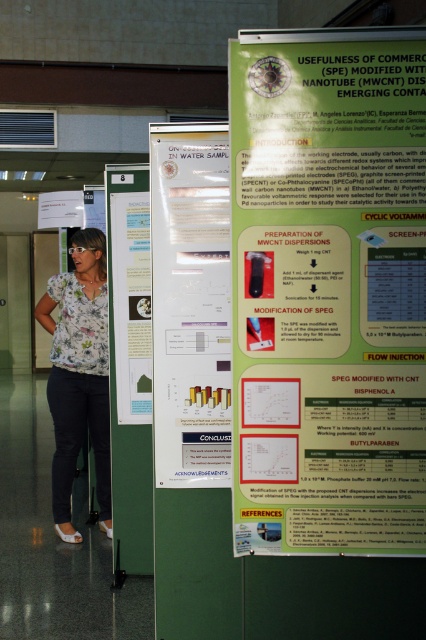
Does white paper at center have a lesser width compared to floral print blouse at center?

Yes, white paper at center is thinner than floral print blouse at center.

Can you confirm if white paper at center is positioned above floral print blouse at center?

Yes.

I want to click on white paper at center, so 190,304.

Who is more distant from viewer, [63,323] or [109,170]?

The point [63,323] is more distant.

The width and height of the screenshot is (426, 640). Describe the element at coordinates (78, 374) in the screenshot. I see `floral print blouse at center` at that location.

Which is in front, point (66, 442) or point (123, 410)?

Point (123, 410) is in front.

I want to click on floral print blouse at center, so click(x=78, y=374).

Is matte green poster at center above floral print blouse at center?

Indeed, matte green poster at center is positioned over floral print blouse at center.

Is matte green poster at center wider than floral print blouse at center?

Correct, the width of matte green poster at center exceeds that of floral print blouse at center.

Find the location of `matte green poster at center`. matte green poster at center is located at coordinates (328, 291).